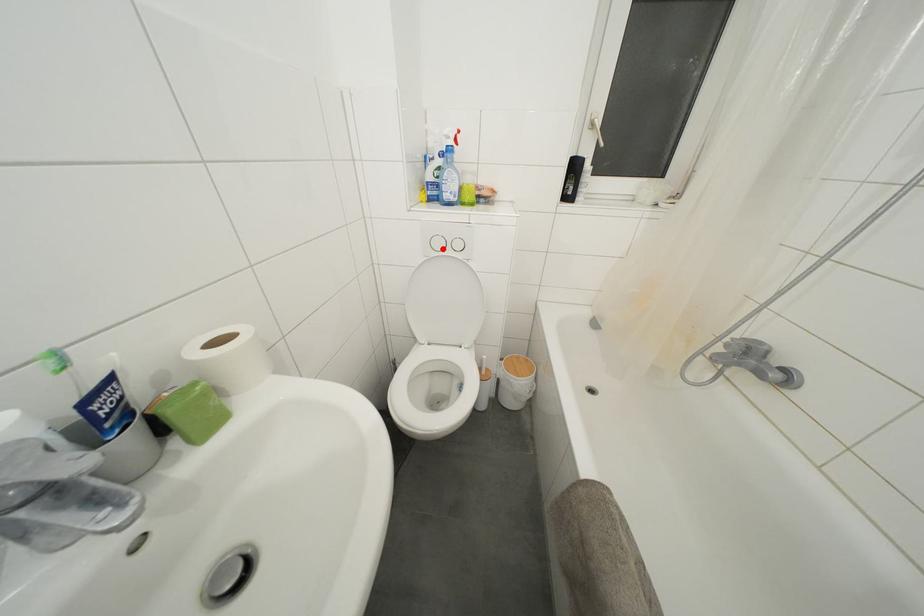
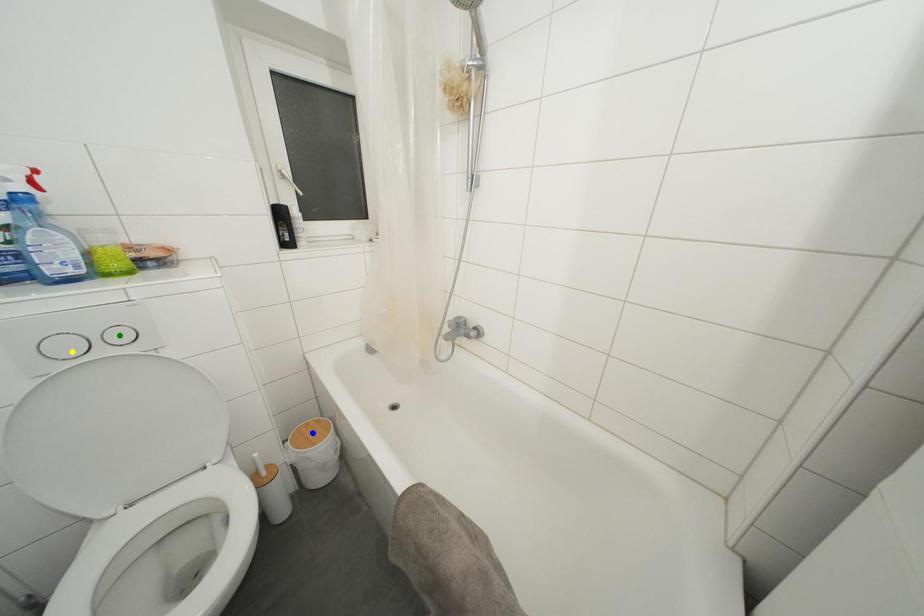
Question: I am providing you with two images of the same scene from different viewpoints. A red point is marked on the first image. You are given multiple points on the second image. Which point in image 2 is actually the same real-world point as the red point in image 1?

Choices:
 (A) blue point
 (B) green point
 (C) yellow point

Answer: (C)